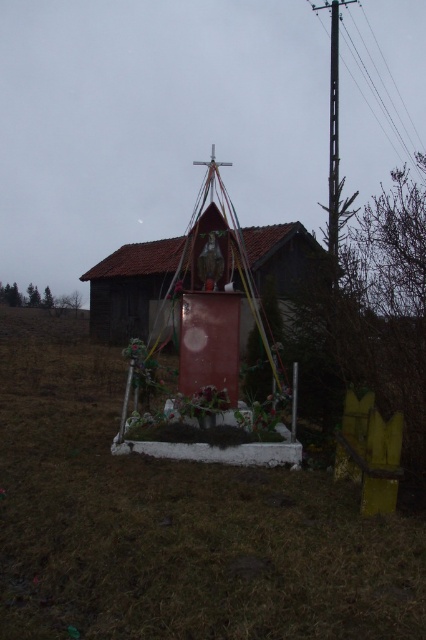
Question: Which of the following is the farthest from the observer?

Choices:
 (A) smooth wooden hut at center
 (B) metallic pole at upper right

Answer: (B)

Question: Does smooth wooden hut at center appear under metallic pole at upper right?

Choices:
 (A) yes
 (B) no

Answer: (A)

Question: Which point is closer to the camera taking this photo?

Choices:
 (A) (350, 44)
 (B) (109, 300)

Answer: (B)

Question: Is smooth wooden hut at center below metallic pole at upper right?

Choices:
 (A) yes
 (B) no

Answer: (A)

Question: Does smooth wooden hut at center appear under metallic pole at upper right?

Choices:
 (A) yes
 (B) no

Answer: (A)